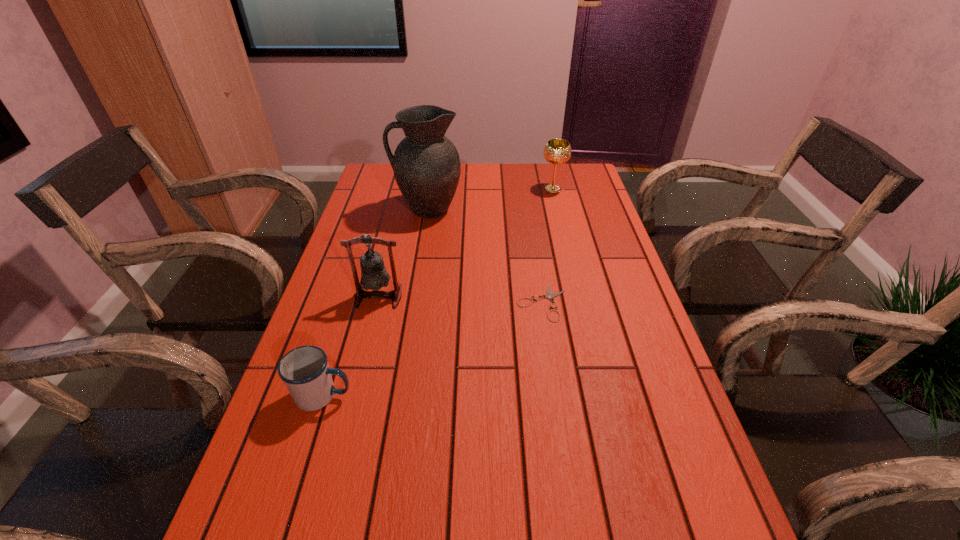
What are the coordinates of `vacant space located on the handle side of the mug` in the screenshot? It's located at (539, 395).

Locate an element on the screen. vacant area situated on the left of the shortest object is located at coordinates (418, 302).

This screenshot has height=540, width=960. Identify the location of pitcher that is at the far edge. (426, 164).

This screenshot has width=960, height=540. Identify the location of chalice located at the far edge. (557, 151).

Where is `pitcher present at the left edge`? pitcher present at the left edge is located at coordinates (426, 164).

I want to click on bell positioned at the left edge, so click(374, 276).

Where is `mug that is at the left edge`? mug that is at the left edge is located at coordinates (304, 370).

Image resolution: width=960 pixels, height=540 pixels. I want to click on object that is positioned at the right edge, so click(x=557, y=151).

Locate an element on the screen. The image size is (960, 540). object situated at the far left corner is located at coordinates (426, 164).

Identify the location of object that is at the far right corner. (557, 151).